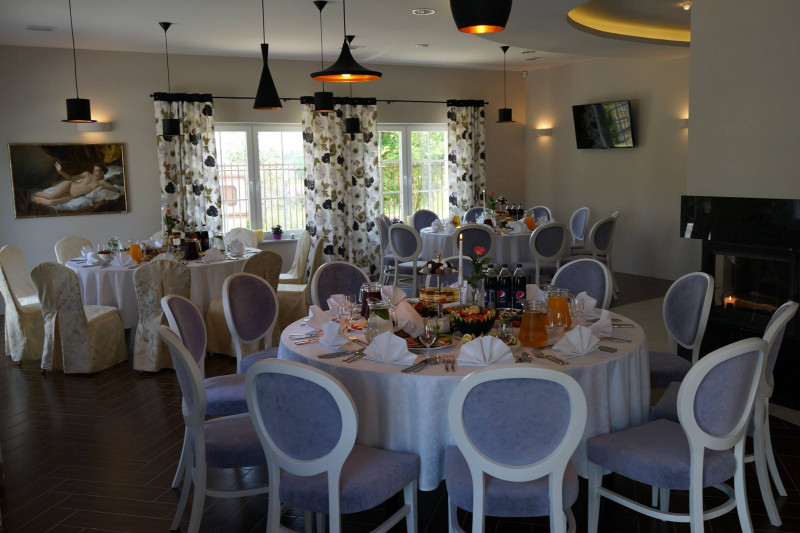
Image resolution: width=800 pixels, height=533 pixels. In order to click on curtain panel in this screenshot , I will do `click(326, 169)`, `click(360, 158)`, `click(462, 161)`, `click(196, 173)`.